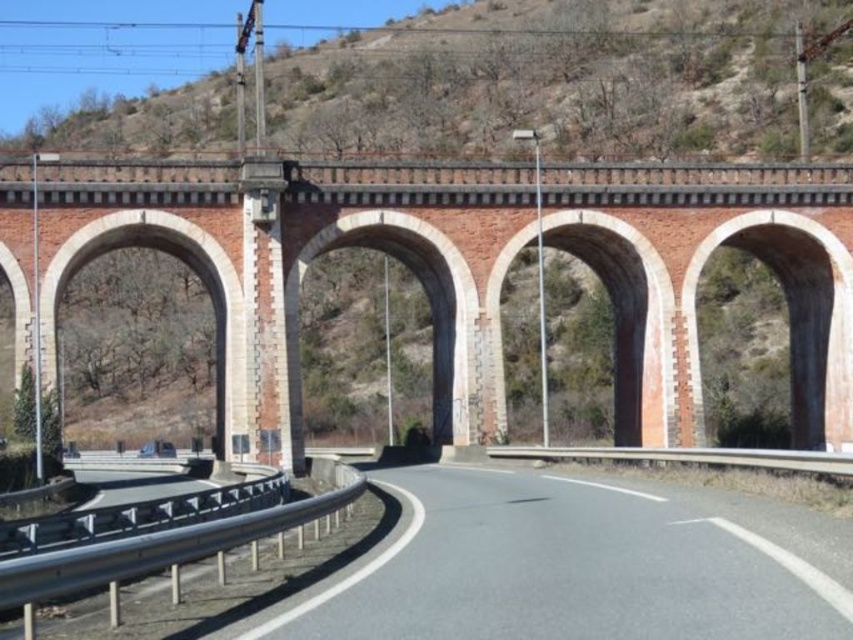
You are a civil engineer assessing the structural integrity of the red brick bridge at center and the metallic gray train track at lower left. Which structure has a greater width according to the provided information?

The red brick bridge at center has a greater width than the metallic gray train track at lower left as stated in the description.

You are a surveyor tasked with identifying the central feature of the viaduct in the image. According to the coordinates provided, which object corresponds to the point at (451, 273)?

The point at (451, 273) corresponds to the red brick bridge at center.

You are a drone operator trying to capture a photo of the red brick bridge at center. The camera is currently positioned at point A, which is at coordinates 0.3, 0.5. To ensure the bridge is centered in the photo, should you move the camera slightly to the right or left? Please explain your reasoning based on the bridge and camera positions.

The red brick bridge at center is located at point (451, 273). The camera is at (426, 192). To center the bridge, move the camera to the right because the bridge is to the right of the current position.